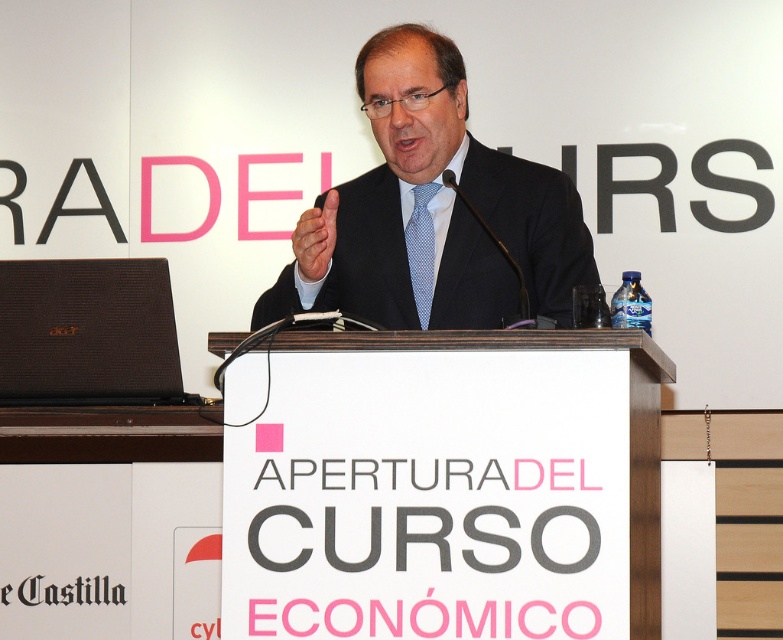
Can you confirm if dark blue suit at center is positioned above brown textured laptop at left?

Correct, dark blue suit at center is located above brown textured laptop at left.

Who is shorter, dark blue suit at center or brown textured laptop at left?

Standing shorter between the two is brown textured laptop at left.

You are a GUI agent. You are given a task and a screenshot of the screen. Output one action in this format:
    pyautogui.click(x=<x>, y=<y>)
    Task: Click on the dark blue suit at center
    The image size is (783, 640).
    Given the screenshot: What is the action you would take?
    pyautogui.click(x=431, y=211)